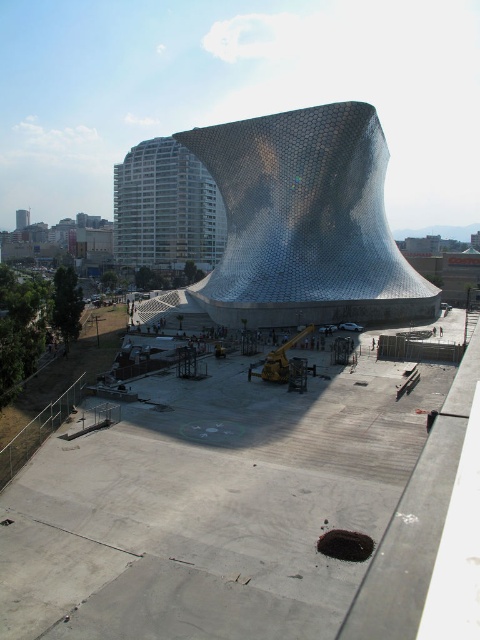
You are a construction worker planning to place a new equipment container that is 5 meters wide. You see the concrete at center and the white glass building at upper left. Which location has enough space to accommodate the container without overlapping?

The white glass building at upper left is larger than the concrete at center, so the container can be placed at the white glass building at upper left since it has more space.

You are standing at the entrance of the building and want to walk to the yellow crane in the foreground. Which direction should you head relative to the concrete at center?

The concrete at center is located at point (233,508). Since the yellow crane is centrally positioned in the foreground, you should head towards the center of the image, which is the direction opposite to the concrete at center.

You are an architect visiting the construction site and want to sit on the matte gray concrete bench at center to sketch the metallic honeycomb structure at center. Can you see the entire structure from where the bench is located?

The matte gray concrete bench at center is behind the metallic honeycomb structure at center, so you cannot see the entire structure from there as the bench is positioned behind it.